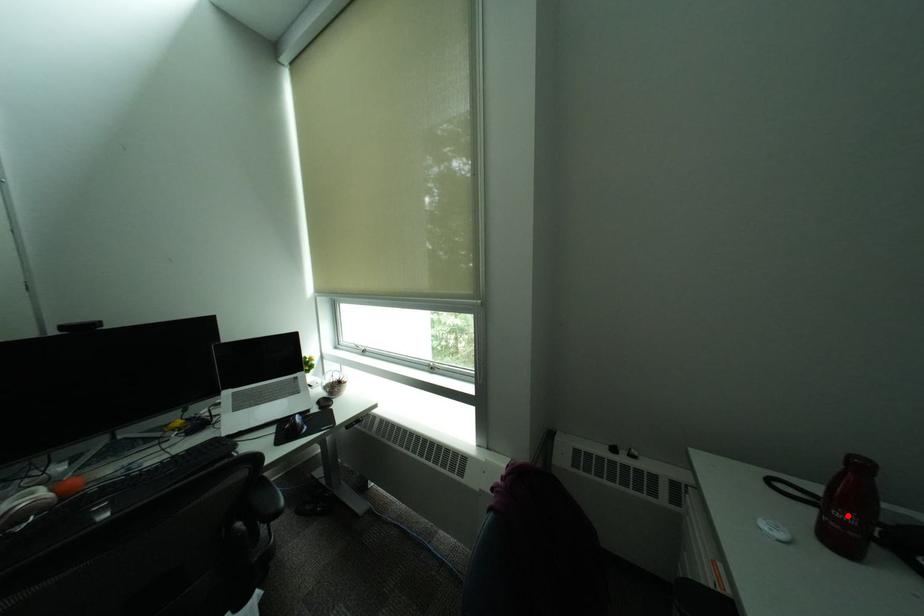
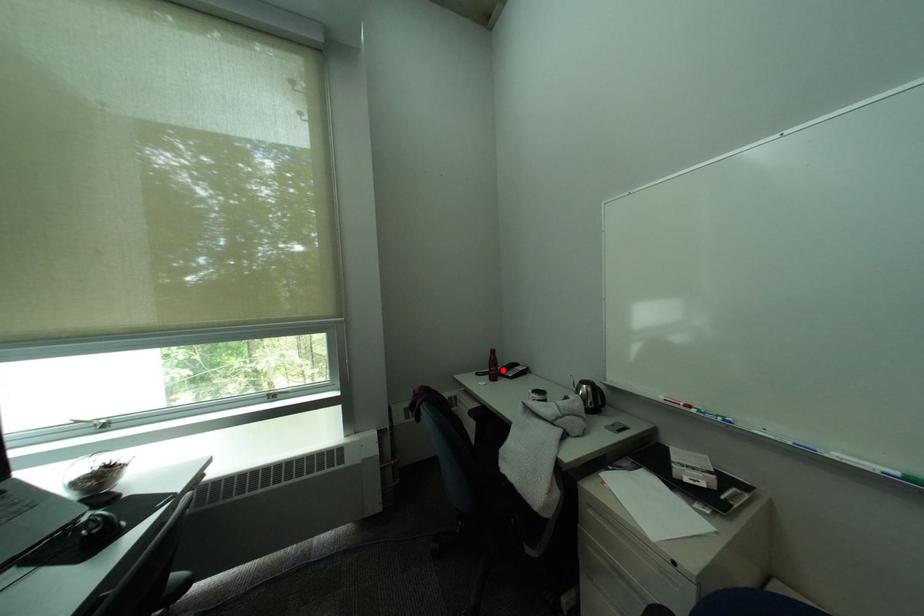
Based on the photo, I am providing you with two images of the same scene from different viewpoints. A red point is marked on the first image and another point is marked on the second image. Are the points marked in image1 and image2 representing the same 3D position?

Yes